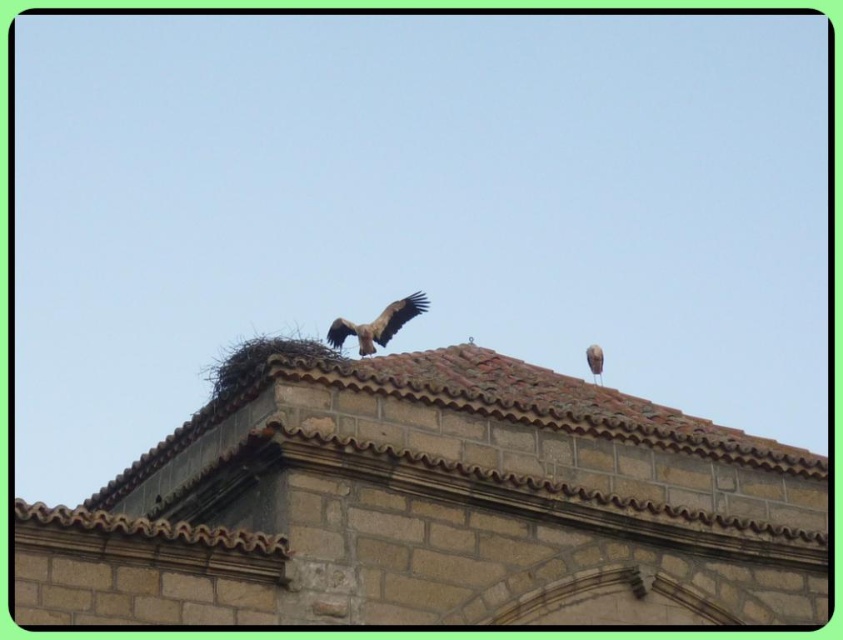
You are a photographer aiming to capture the brown tile roof at upper center and the brown feathered eagle at center in a single shot. Based on their positions, which object appears larger in the frame?

The brown tile roof at upper center appears larger in the frame because it is closer to the viewer than the brown feathered eagle at center.

You are standing in front of the building with the stork on the roof. You notice two points marked on the roof. Which point is closer to you, point (337, 330) or point (591, 353)?

Point (337, 330) is further to the viewer than point (591, 353), so point (337, 330) is closer to you.